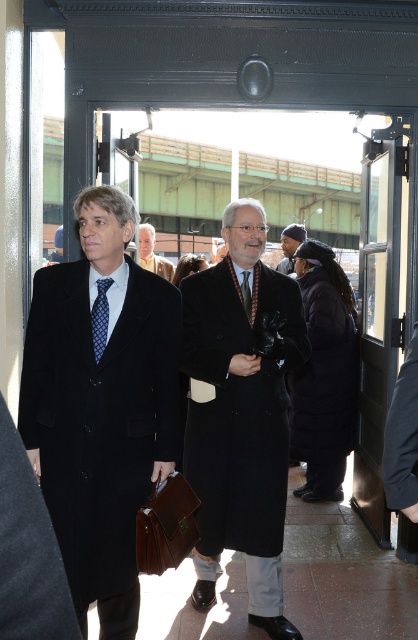
Question: Does light brown leather jacket at center appear under black wool coat at center?

Choices:
 (A) yes
 (B) no

Answer: (B)

Question: Observing the image, what is the correct spatial positioning of matte black coat at left in reference to dark blue knit hat at center?

Choices:
 (A) right
 (B) left

Answer: (B)

Question: Which point is closer to the camera taking this photo?

Choices:
 (A) (231, 490)
 (B) (114, 260)

Answer: (B)

Question: Which object appears farthest from the camera in this image?

Choices:
 (A) red plaid tie at center
 (B) light brown leather jacket at center
 (C) matte black coat at left
 (D) blue dotted tie at left

Answer: (B)

Question: Which object is the farthest from the blue dotted tie at left?

Choices:
 (A) light brown leather jacket at center
 (B) black wool coat at center
 (C) red plaid tie at center

Answer: (B)

Question: Considering the relative positions of blue dotted tie at left and black wool coat at center in the image provided, where is blue dotted tie at left located with respect to black wool coat at center?

Choices:
 (A) left
 (B) right

Answer: (B)